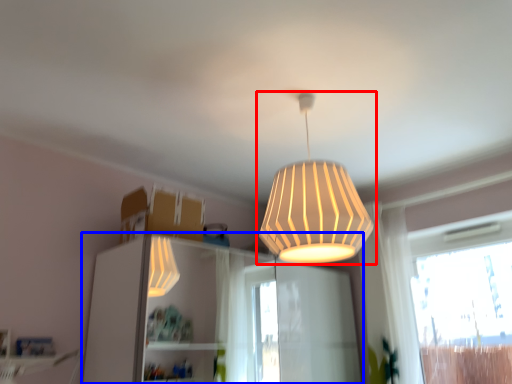
Question: Among these objects, which one is farthest to the camera, lamp (highlighted by a red box) or dresser (highlighted by a blue box)?

Choices:
 (A) lamp
 (B) dresser

Answer: (B)